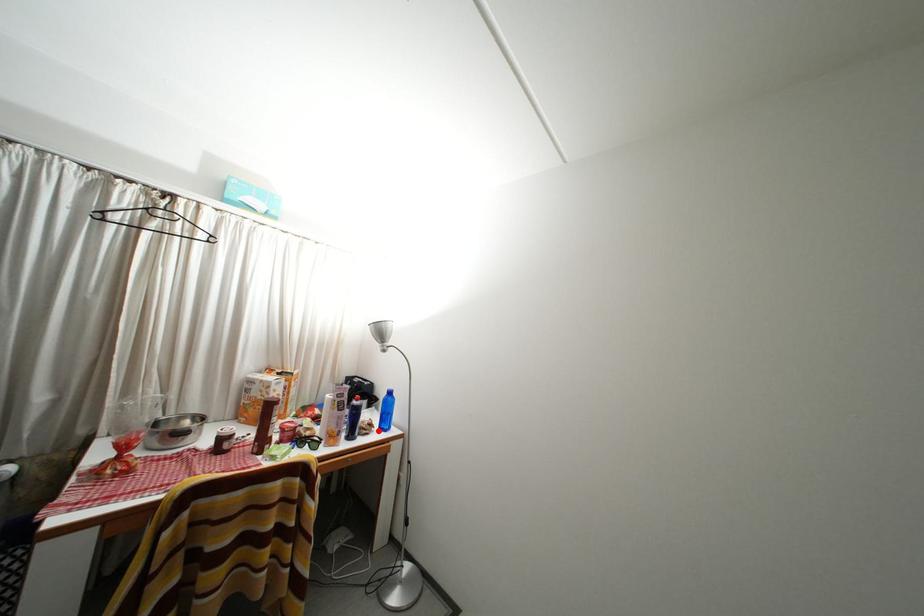
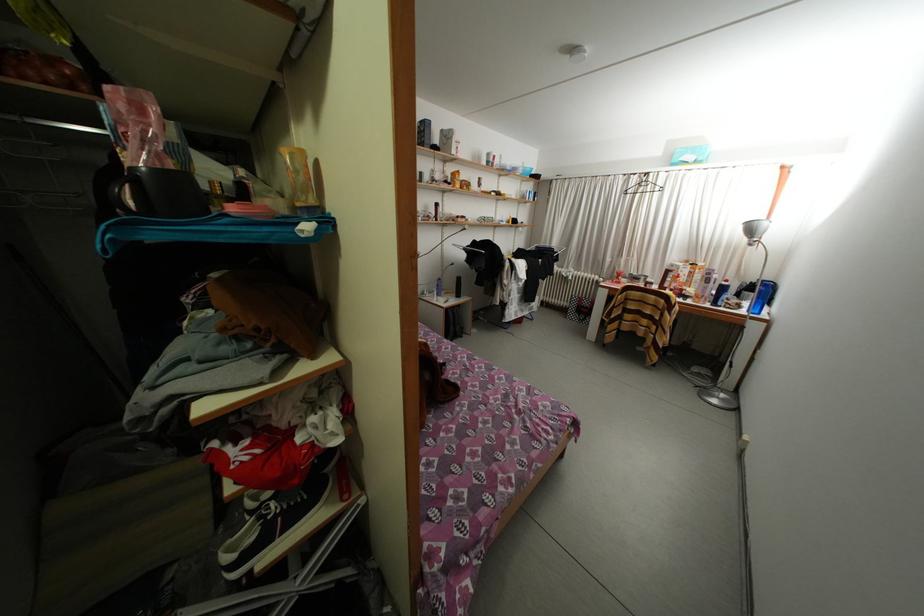
Where in the second image is the point corresponding to the highlighted location from the first image?

(747, 310)